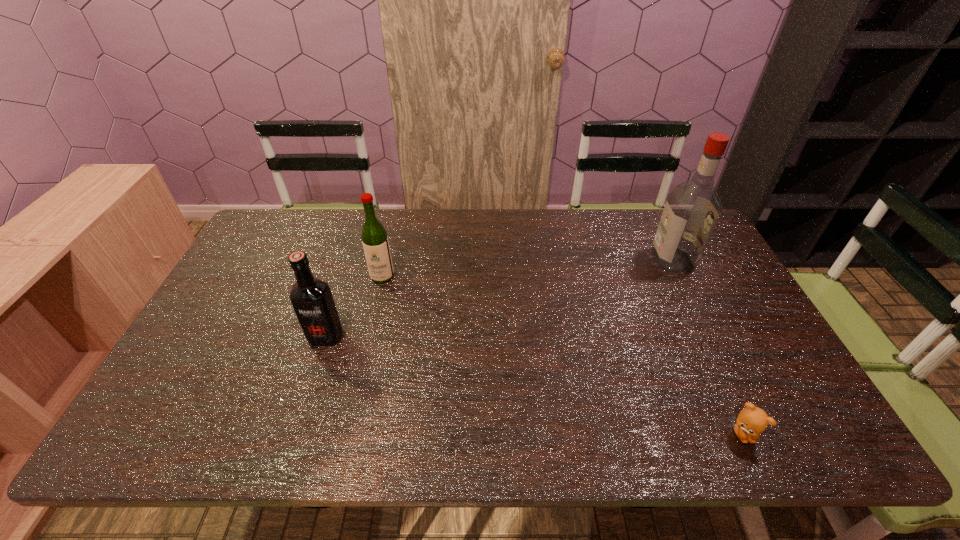
Find the location of `the tallest liquor`. the tallest liquor is located at coordinates (692, 208).

Locate an element on the screen. This screenshot has height=540, width=960. the tallest object is located at coordinates (692, 208).

Image resolution: width=960 pixels, height=540 pixels. What are the coordinates of `the second liquor from right to left` in the screenshot? It's located at (375, 242).

You are a GUI agent. You are given a task and a screenshot of the screen. Output one action in this format:
    pyautogui.click(x=<x>, y=<y>)
    Task: Click on the nearest liquor
    
    Given the screenshot: What is the action you would take?
    pyautogui.click(x=312, y=300)

Locate an element on the screen. This screenshot has width=960, height=540. the leftmost liquor is located at coordinates (312, 300).

This screenshot has height=540, width=960. In order to click on the shortest object in this screenshot , I will do `click(752, 421)`.

What are the coordinates of `the nearest object` in the screenshot? It's located at (752, 421).

At what (x,y) coordinates should I click in order to perform the action: click on free point located on the front-facing side of the tallest object. Please return your answer as a coordinate pair (x, y). Looking at the image, I should click on (628, 260).

The width and height of the screenshot is (960, 540). Find the location of `blank area located 0.100m on the front-facing side of the tallest object`. blank area located 0.100m on the front-facing side of the tallest object is located at coordinates (622, 260).

Locate an element on the screen. The width and height of the screenshot is (960, 540). free region located on the front-facing side of the tallest object is located at coordinates (534, 260).